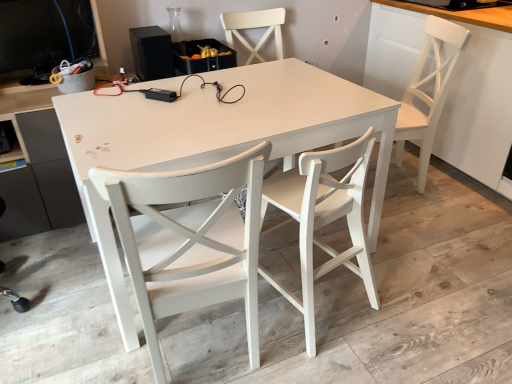
Locate an element on the screen. This screenshot has height=384, width=512. vacant area situated below white painted wood chair at center, placed as the first chair when sorted from left to right (from a real-world perspective) is located at coordinates (210, 350).